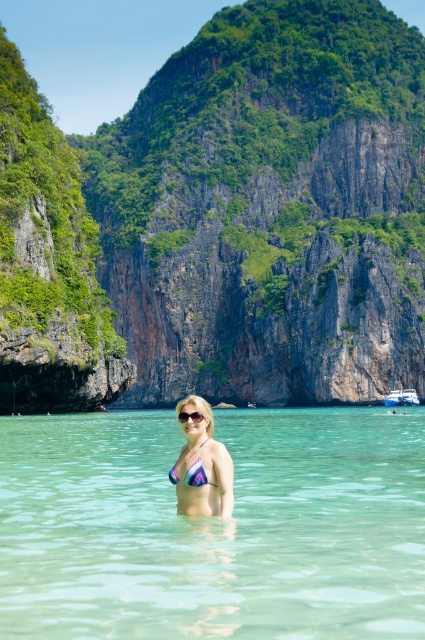
Between point (407, 401) and point (187, 419), which one is positioned behind?

Positioned behind is point (407, 401).

Consider the image. Is white glossy boat at center above transparent plastic goggles at center?

No.

Is point (410, 400) farther from camera compared to point (183, 420)?

That is True.

Where is `white glossy boat at center`? The image size is (425, 640). white glossy boat at center is located at coordinates (402, 397).

Can you confirm if multicolored fabric bikini at center is bigger than transparent plastic goggles at center?

Correct, multicolored fabric bikini at center is larger in size than transparent plastic goggles at center.

Identify the location of multicolored fabric bikini at center. (197, 470).

Which is behind, point (198, 483) or point (187, 417)?

The point (187, 417) is more distant.

At what (x,y) coordinates should I click in order to perform the action: click on multicolored fabric bikini at center. Please return your answer as a coordinate pair (x, y). Looking at the image, I should click on (197, 470).

Is point (50, 481) behind point (192, 417)?

Yes, it is behind point (192, 417).

The height and width of the screenshot is (640, 425). What do you see at coordinates (214, 528) in the screenshot? I see `clear water at center` at bounding box center [214, 528].

Who is more forward, (x=385, y=570) or (x=183, y=412)?

Point (x=385, y=570)

The height and width of the screenshot is (640, 425). I want to click on clear water at center, so click(214, 528).